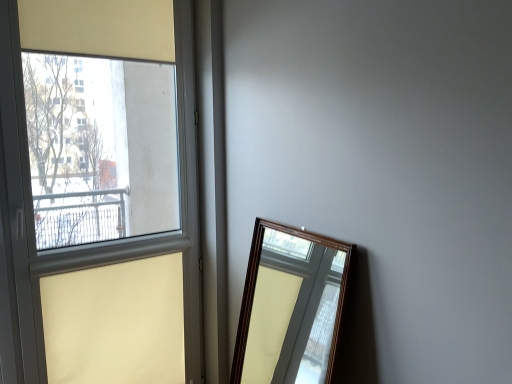
Describe the element at coordinates (98, 244) in the screenshot. The height and width of the screenshot is (384, 512). I see `transparent glass window at left` at that location.

Where is `transparent glass window at left`? The height and width of the screenshot is (384, 512). transparent glass window at left is located at coordinates (98, 244).

Image resolution: width=512 pixels, height=384 pixels. I want to click on transparent glass window at left, so click(98, 244).